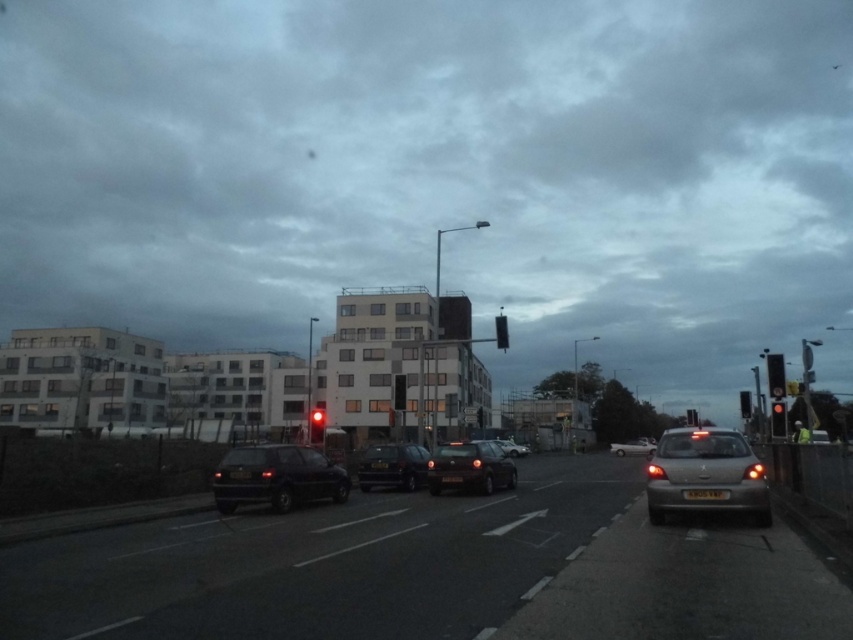
Between matte black traffic light at center and white glossy sedan at center, which one appears on the right side from the viewer's perspective?

white glossy sedan at center

Is point (607, 230) more distant than point (635, 445)?

That is True.

Image resolution: width=853 pixels, height=640 pixels. What do you see at coordinates (439, 173) in the screenshot?
I see `matte black traffic light at center` at bounding box center [439, 173].

I want to click on matte black traffic light at center, so click(x=439, y=173).

Does point (125, 106) come in front of point (773, 381)?

No, (125, 106) is behind (773, 381).

Which is behind, point (132, 292) or point (775, 392)?

The point (132, 292) is more distant.

Who is more forward, (260,172) or (773,378)?

Point (773,378) is in front.

This screenshot has width=853, height=640. I want to click on matte black traffic light at center, so click(439, 173).

Which is behind, point (613, 449) or point (770, 410)?

The point (613, 449) is more distant.

Is point (612, 445) farther from camera compared to point (782, 436)?

Yes.

This screenshot has height=640, width=853. What are the coordinates of `white glossy sedan at center` in the screenshot? It's located at (633, 445).